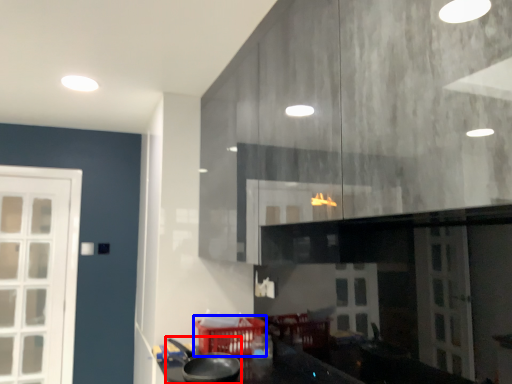
Question: Which of the following is the closest to the observer, wok (highlighted by a red box) or basket (highlighted by a blue box)?

Choices:
 (A) wok
 (B) basket

Answer: (A)